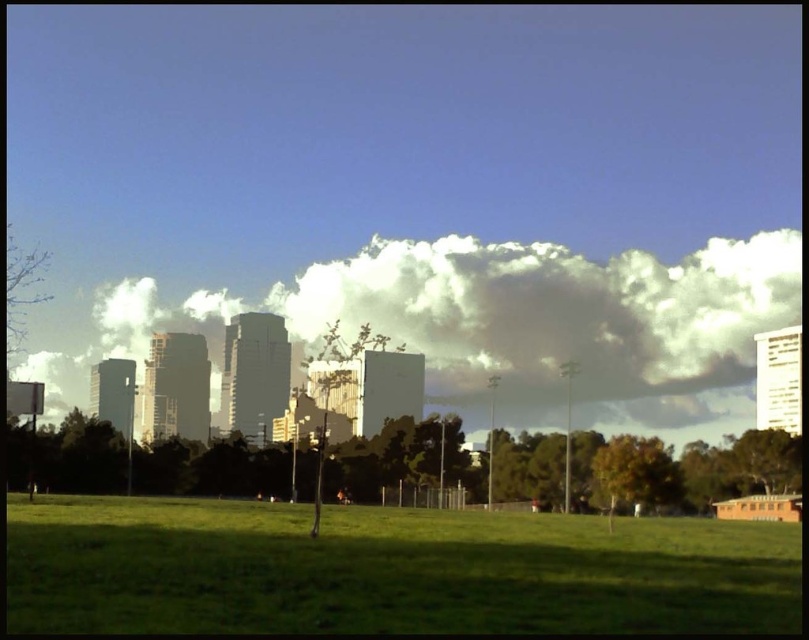
The height and width of the screenshot is (640, 809). Describe the element at coordinates (388, 570) in the screenshot. I see `green grassy field at lower center` at that location.

Find the location of a particular element. Image resolution: width=809 pixels, height=640 pixels. green grassy field at lower center is located at coordinates (388, 570).

Image resolution: width=809 pixels, height=640 pixels. What are the coordinates of `green grassy field at lower center` in the screenshot? It's located at 388,570.

This screenshot has height=640, width=809. What are the coordinates of `green grassy field at lower center` in the screenshot? It's located at [388, 570].